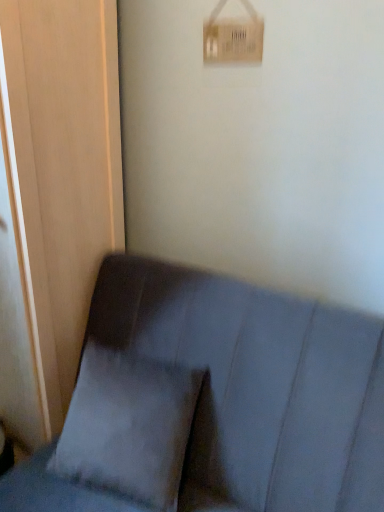
Question: Should I look upward or downward to see white cardboard light switch at upper center?

Choices:
 (A) down
 (B) up

Answer: (B)

Question: Is white cardboard light switch at upper center facing away from suede gray couch at lower left?

Choices:
 (A) no
 (B) yes

Answer: (A)

Question: Is white cardboard light switch at upper center positioned beyond the bounds of suede gray couch at lower left?

Choices:
 (A) no
 (B) yes

Answer: (B)

Question: Is white cardboard light switch at upper center positioned in front of suede gray couch at lower left?

Choices:
 (A) yes
 (B) no

Answer: (B)

Question: Is white cardboard light switch at upper center far away from suede gray couch at lower left?

Choices:
 (A) no
 (B) yes

Answer: (A)

Question: Does white cardboard light switch at upper center have a greater height compared to suede gray couch at lower left?

Choices:
 (A) yes
 (B) no

Answer: (B)

Question: Is the surface of white cardboard light switch at upper center in direct contact with suede gray couch at lower left?

Choices:
 (A) no
 (B) yes

Answer: (A)

Question: From a real-world perspective, is white cardboard light switch at upper center physically above gray fabric pillow at lower left?

Choices:
 (A) no
 (B) yes

Answer: (B)

Question: From a real-world perspective, is white cardboard light switch at upper center physically below gray fabric pillow at lower left?

Choices:
 (A) no
 (B) yes

Answer: (A)

Question: Considering the relative sizes of white cardboard light switch at upper center and gray fabric pillow at lower left in the image provided, is white cardboard light switch at upper center bigger than gray fabric pillow at lower left?

Choices:
 (A) no
 (B) yes

Answer: (A)

Question: Is white cardboard light switch at upper center wider than gray fabric pillow at lower left?

Choices:
 (A) yes
 (B) no

Answer: (B)

Question: From the image's perspective, does white cardboard light switch at upper center appear lower than gray fabric pillow at lower left?

Choices:
 (A) no
 (B) yes

Answer: (A)

Question: Does white cardboard light switch at upper center turn towards gray fabric pillow at lower left?

Choices:
 (A) no
 (B) yes

Answer: (A)

Question: Can you confirm if matte wood screen door at left is thinner than suede gray couch at lower left?

Choices:
 (A) no
 (B) yes

Answer: (B)